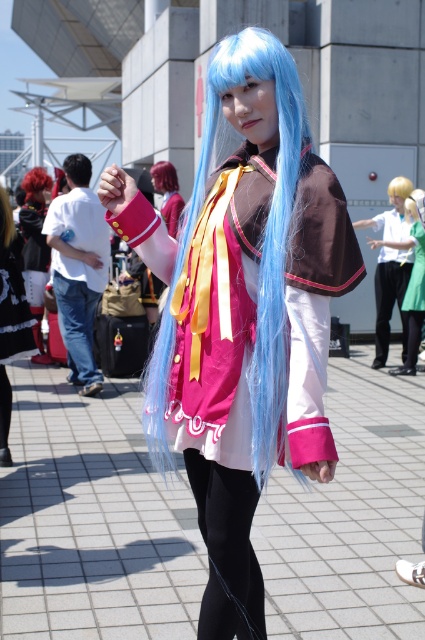
Looking at this image, you are a photographer at the cosplay event and want to focus on the matte pink fabric dress at center and the jeans at center. Which one is closer to you?

The matte pink fabric dress at center is closer to you than the jeans at center.

You are standing at the cosplay event and want to take a photo of the central figure. The camera you have can focus on objects up to 10 meters away. Is the point at coordinates point (404, 294) within the camera focus range?

The point (404, 294) is 11.22 meters away from the viewer, which exceeds the camera focus range of 10 meters. Therefore, the camera cannot focus on that point.